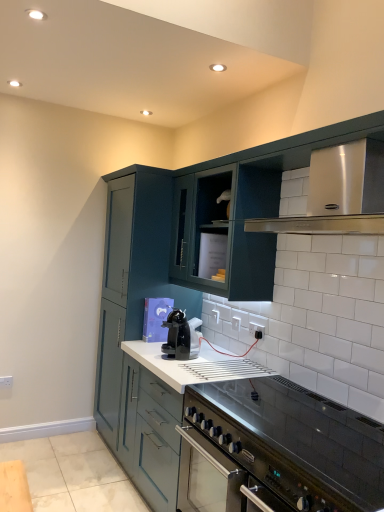
Question: Considering the relative sizes of teal matte cabinet at center, which appears as the 2th cabinetry when viewed from the front, and satin silver vent at upper right in the image provided, is teal matte cabinet at center, which appears as the 2th cabinetry when viewed from the front, shorter than satin silver vent at upper right?

Choices:
 (A) yes
 (B) no

Answer: (B)

Question: Considering the relative positions of teal matte cabinet at center, marked as the first cabinetry in a back-to-front arrangement, and satin silver vent at upper right in the image provided, is teal matte cabinet at center, marked as the first cabinetry in a back-to-front arrangement, behind satin silver vent at upper right?

Choices:
 (A) yes
 (B) no

Answer: (A)

Question: Does teal matte cabinet at center, which appears as the 2th cabinetry when viewed from the front, appear on the right side of satin silver vent at upper right?

Choices:
 (A) yes
 (B) no

Answer: (B)

Question: Considering the relative sizes of teal matte cabinet at center, which appears as the 2th cabinetry when viewed from the front, and satin silver vent at upper right in the image provided, is teal matte cabinet at center, which appears as the 2th cabinetry when viewed from the front, smaller than satin silver vent at upper right?

Choices:
 (A) yes
 (B) no

Answer: (B)

Question: Is teal matte cabinet at center, which appears as the 2th cabinetry when viewed from the front, at the left side of satin silver vent at upper right?

Choices:
 (A) no
 (B) yes

Answer: (B)

Question: Is satin silver vent at upper right located within teal matte cabinet at center, marked as the first cabinetry in a back-to-front arrangement?

Choices:
 (A) yes
 (B) no

Answer: (B)

Question: Is teal matte cabinet at center, the second cabinetry in the back-to-front sequence, looking in the opposite direction of stainless steel oven at lower right?

Choices:
 (A) yes
 (B) no

Answer: (B)

Question: Can you confirm if teal matte cabinet at center, the second cabinetry in the back-to-front sequence, is positioned to the left of stainless steel oven at lower right?

Choices:
 (A) yes
 (B) no

Answer: (A)

Question: Does teal matte cabinet at center, the second cabinetry in the back-to-front sequence, have a lesser height compared to stainless steel oven at lower right?

Choices:
 (A) no
 (B) yes

Answer: (A)

Question: From a real-world perspective, does teal matte cabinet at center, which is counted as the first cabinetry, starting from the front, stand above stainless steel oven at lower right?

Choices:
 (A) no
 (B) yes

Answer: (B)

Question: Is teal matte cabinet at center, the second cabinetry in the back-to-front sequence, outside of stainless steel oven at lower right?

Choices:
 (A) yes
 (B) no

Answer: (A)

Question: From a real-world perspective, does teal matte cabinet at center, the second cabinetry in the back-to-front sequence, sit lower than stainless steel oven at lower right?

Choices:
 (A) yes
 (B) no

Answer: (B)

Question: From the image's perspective, would you say satin silver vent at upper right is positioned over black glossy coffee machine at center?

Choices:
 (A) yes
 (B) no

Answer: (A)